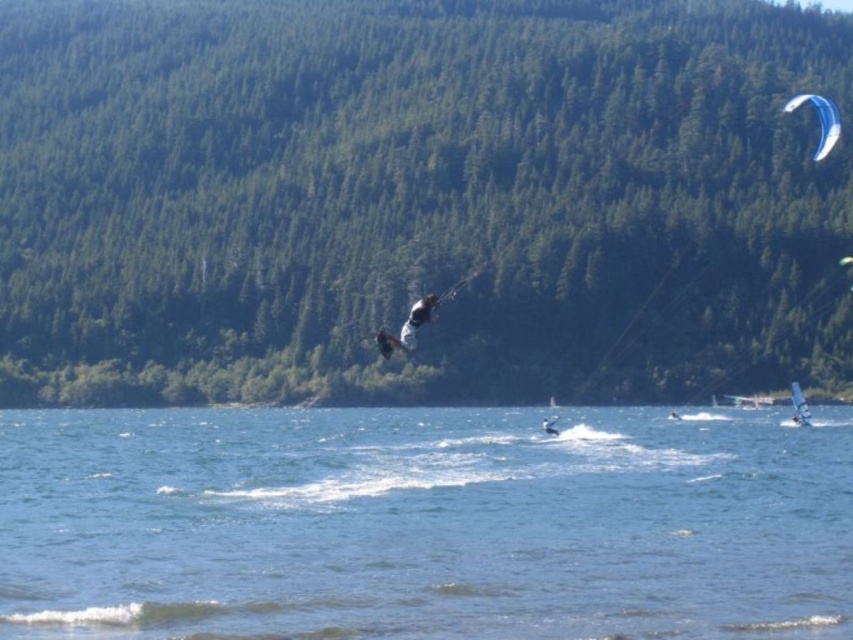
You are a photographer trying to capture the perfect shot of the white fabric kite at center and the white matte surfboard at center. Which object should you focus on first if you want to include both in your frame without moving the camera?

You should focus on the white matte surfboard at center first because the white fabric kite at center is to the left of it, so positioning the surfboard centrally allows the kite to be included on the left side of the frame.

You are standing at the lakeside and want to take a photo of both point (604, 634) and point (399, 348) in the scene. Which point will appear larger in your photo?

Point (604, 634) will appear larger in the photo because it is closer to the viewer than point (399, 348).

You are a photographer planning to take a photo of the clear blue water at center and the white fabric kite at center. Which object should you focus on first if you want to capture both in a single frame without moving the camera?

The clear blue water at center has a larger size compared to the white fabric kite at center, so you should focus on the larger object first to ensure it fills the frame appropriately before adjusting for the smaller kite.